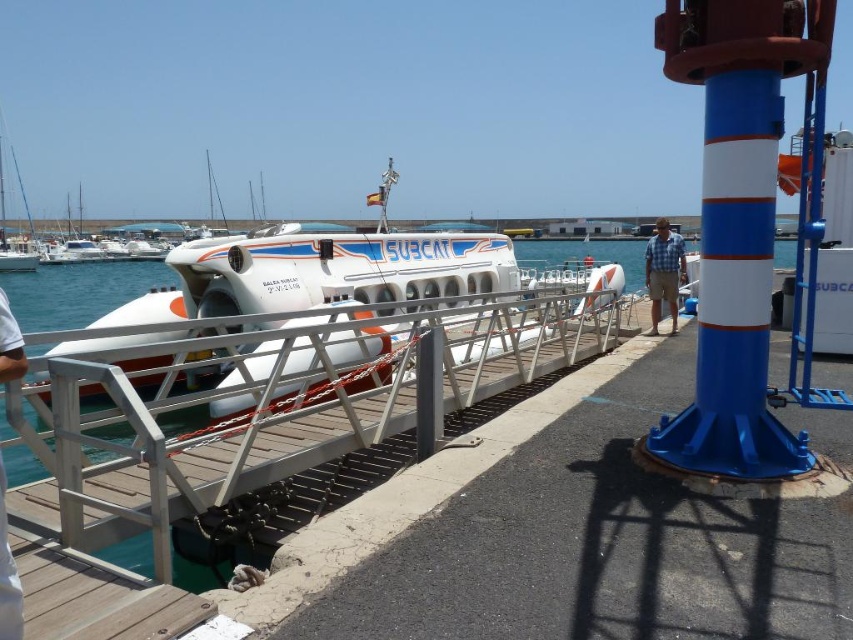
You are standing at the wooden pier near the SUBCAT vessel. You see two points marked on the pier. The first point is at coordinates point (292, 413) and the second is at point (305, 264). If you want to move towards the SUBCAT vessel, which point should you walk towards?

You should walk towards point (292, 413) because it is in front of point (305, 264), meaning it is closer to the SUBCAT vessel.

You are a safety inspector checking the marina. You need to ensure that the white glossy submarine at center is positioned safely behind the silver metallic rail at center. Based on the scene, is the submarine placed correctly according to safety protocols?

The white glossy submarine at center is indeed positioned behind the silver metallic rail at center, so it is placed correctly according to safety protocols.

You are a photographer standing at the edge of the pier, and you want to take a picture of the SUBCAT submarine. The silver metallic rail at center is blocking your view. Can you step back to get a better angle without moving the rail?

The silver metallic rail at center is 8.91 meters away from the camera. Since the rail is quite far away, stepping back a few meters might allow you to position yourself so that the rail no longer blocks your view of the SUBCAT submarine.